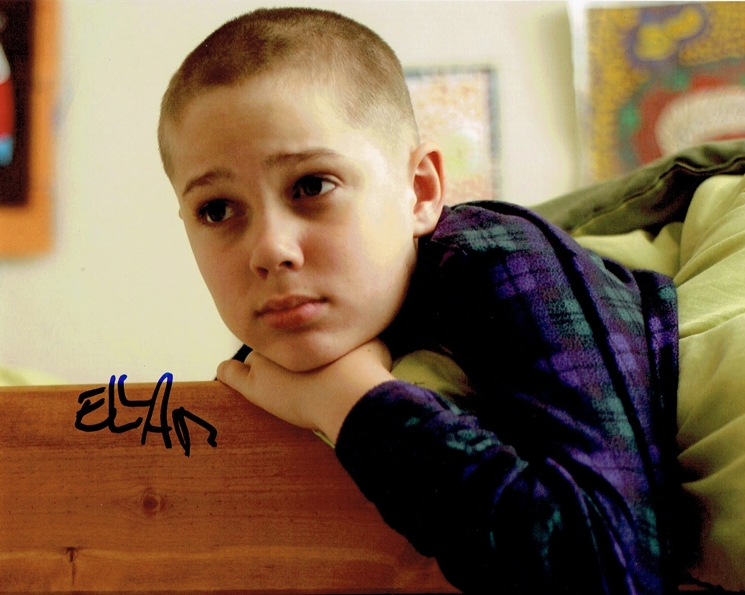
At what (x,y) coordinates should I click in order to perform the action: click on dark green blanket. Please return your answer as a coordinate pair (x, y). Looking at the image, I should click on (640, 194), (597, 196).